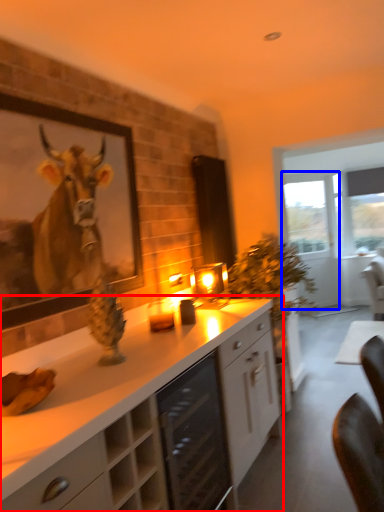
Question: Which object appears closest to the camera in this image, cabinetry (highlighted by a red box) or glass door (highlighted by a blue box)?

Choices:
 (A) cabinetry
 (B) glass door

Answer: (A)